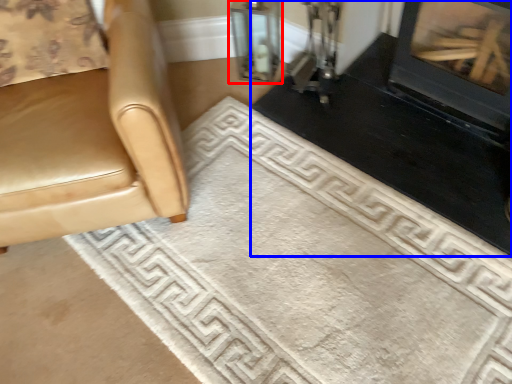
Question: Which object appears closest to the camera in this image, glass door (highlighted by a red box) or fireplace (highlighted by a blue box)?

Choices:
 (A) glass door
 (B) fireplace

Answer: (B)